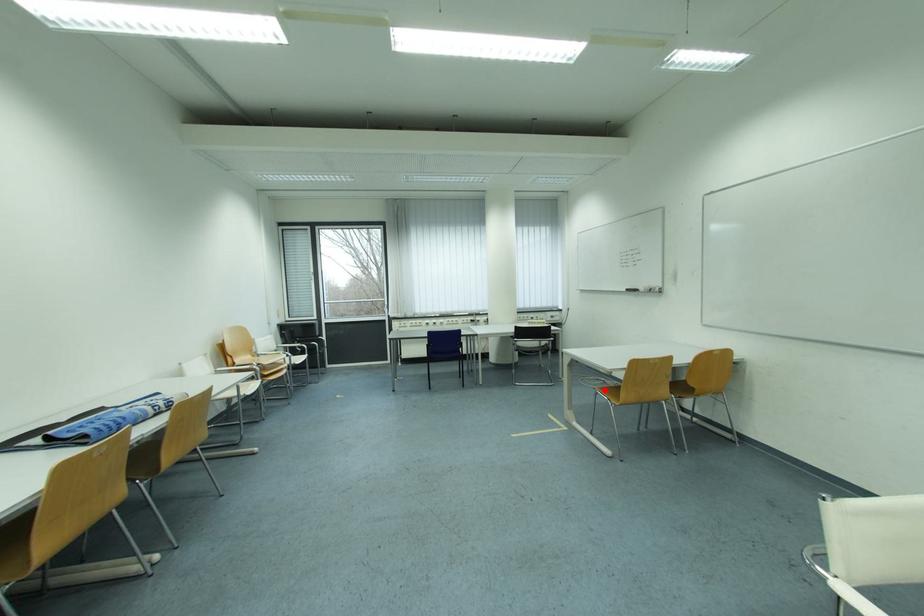
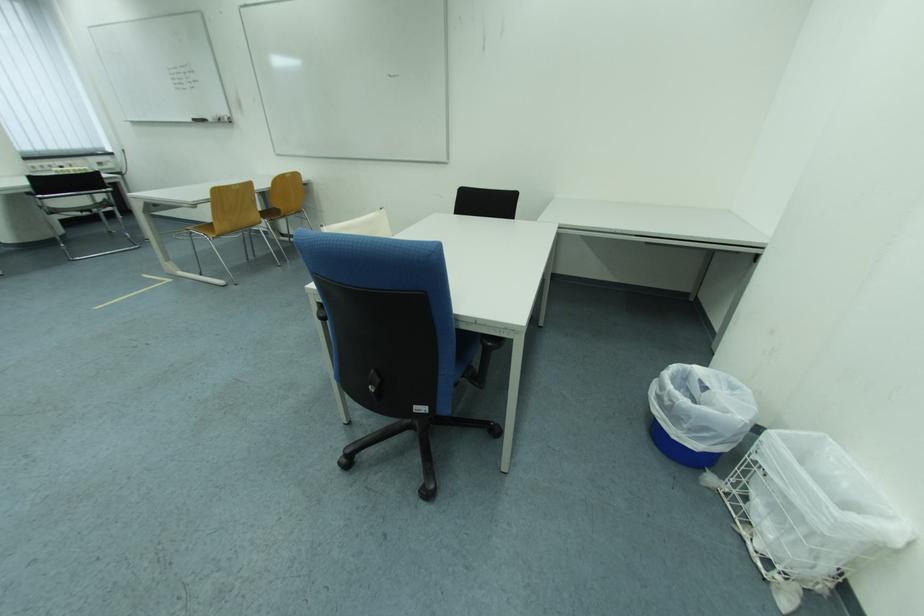
Question: I am providing you with two images of the same scene from different viewpoints. A red point is shown in image1. For the corresponding object point in image2, is it positioned nearer or farther from the camera?

Choices:
 (A) Nearer
 (B) Farther

Answer: (A)